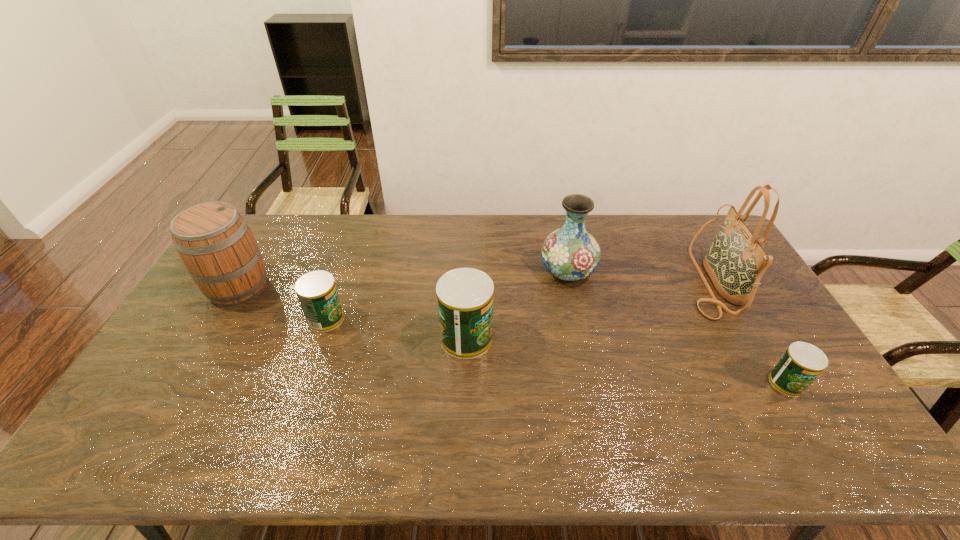
This screenshot has height=540, width=960. What are the coordinates of `unoccupied area between the vase and the tallest object` in the screenshot? It's located at (638, 275).

Where is `vacant point located between the fourth object from left to right and the handbag`? vacant point located between the fourth object from left to right and the handbag is located at coordinates (638, 275).

Locate an element on the screen. This screenshot has height=540, width=960. free space between the vase and the rightmost can is located at coordinates (677, 327).

Where is `vacant space in between the nearest object and the leftmost can`? vacant space in between the nearest object and the leftmost can is located at coordinates (557, 350).

Where is `unoccupied area between the tallest object and the third object from left to right`? unoccupied area between the tallest object and the third object from left to right is located at coordinates 588,309.

This screenshot has height=540, width=960. What are the coordinates of `vacant area between the leftmost can and the nearest can` in the screenshot? It's located at (557, 350).

Find the location of `object that is the fourth nearest to the vase`. object that is the fourth nearest to the vase is located at coordinates (316, 290).

Identify the location of object that ranks as the fourth closest to the third object from right to left. (316, 290).

Identify the location of can that is the closest to the leftmost can. (465, 296).

Identify which can is the third nearest to the handbag. Please provide its 2D coordinates. Your answer should be formatted as a tuple, i.e. [(x, y)], where the tuple contains the x and y coordinates of a point satisfying the conditions above.

[(316, 290)]